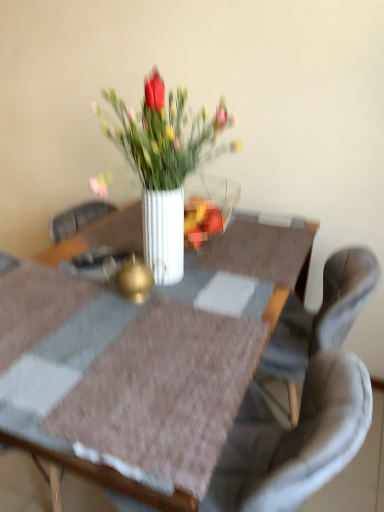
Where is `vacant area that is in front of white glossy vase at center`? vacant area that is in front of white glossy vase at center is located at coordinates (206, 275).